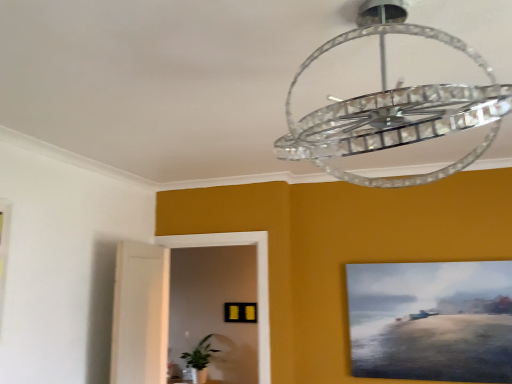
Question: From a real-world perspective, is clear crystal chandelier at upper center positioned above or below green leafy plant at lower left?

Choices:
 (A) below
 (B) above

Answer: (B)

Question: Based on their positions, is clear crystal chandelier at upper center located to the left or right of green leafy plant at lower left?

Choices:
 (A) left
 (B) right

Answer: (B)

Question: Which object is the closest to the green leafy plant at lower left?

Choices:
 (A) clear crystal chandelier at upper center
 (B) matte canvas painting at right, the 2th picture frame viewed from the back
 (C) matte yellow picture frame at center, the 1th picture frame positioned from the left

Answer: (C)

Question: Based on their relative distances, which object is farther from the matte yellow picture frame at center, which ranks as the 1th picture frame in back-to-front order?

Choices:
 (A) green leafy plant at lower left
 (B) matte canvas painting at right, which is the second picture frame from left to right
 (C) clear crystal chandelier at upper center

Answer: (C)